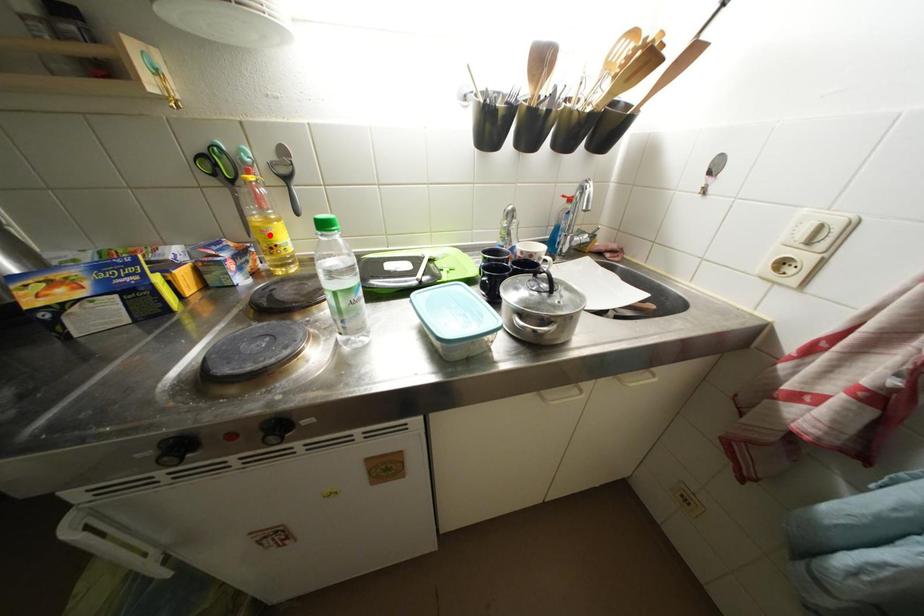
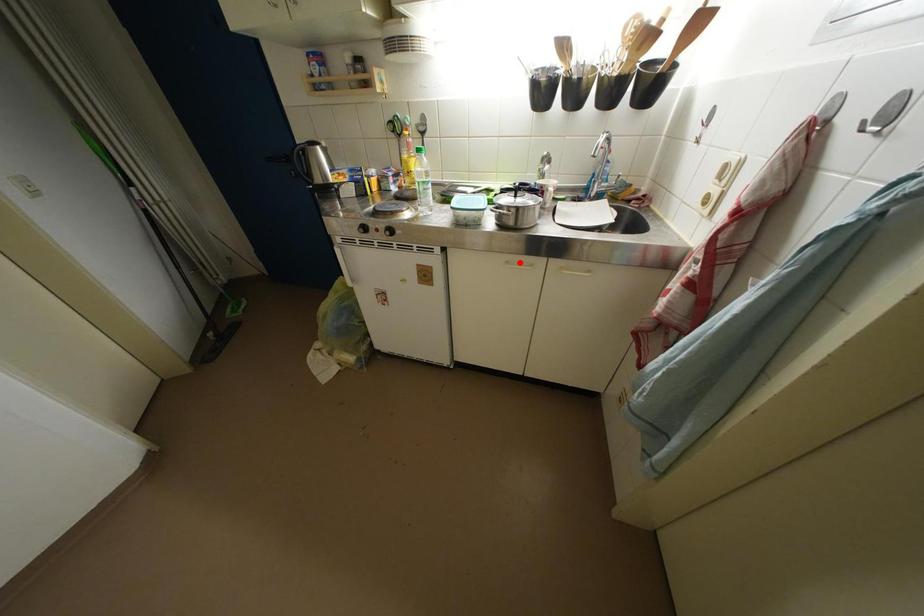
I am providing you with two images of the same scene from different viewpoints. A red point is marked on the first image and another point is marked on the second image. Do the highlighted points in image1 and image2 indicate the same real-world spot?

No